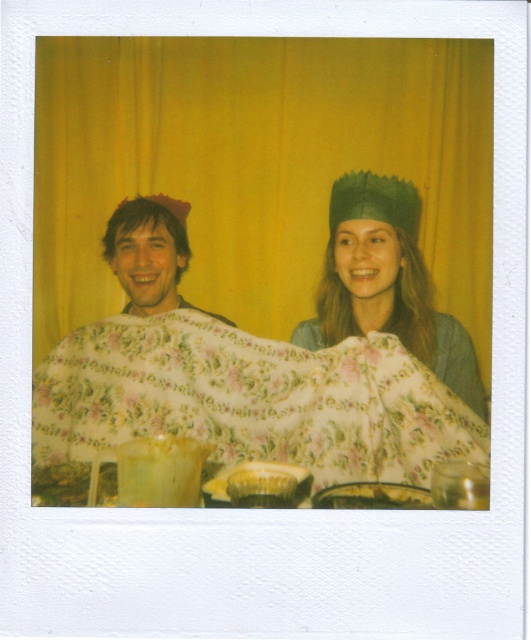
Question: Which point appears closest to the camera in this image?

Choices:
 (A) (75, 385)
 (B) (147, 218)
 (C) (375, 499)

Answer: (C)

Question: Which point is closer to the camera?

Choices:
 (A) yellowish plastic container at lower center
 (B) floral fabric cape at center
 (C) matte floral blanket at left

Answer: (A)

Question: Can you confirm if floral cotton blanket at center is positioned to the left of matte floral blanket at left?

Choices:
 (A) yes
 (B) no

Answer: (B)

Question: Does floral fabric cape at center have a smaller size compared to matte floral blanket at left?

Choices:
 (A) no
 (B) yes

Answer: (A)

Question: Can you confirm if matte floral blanket at left is smaller than yellowish plastic container at lower center?

Choices:
 (A) yes
 (B) no

Answer: (B)

Question: Among these objects, which one is nearest to the camera?

Choices:
 (A) matte floral blanket at left
 (B) floral fabric cape at center

Answer: (B)